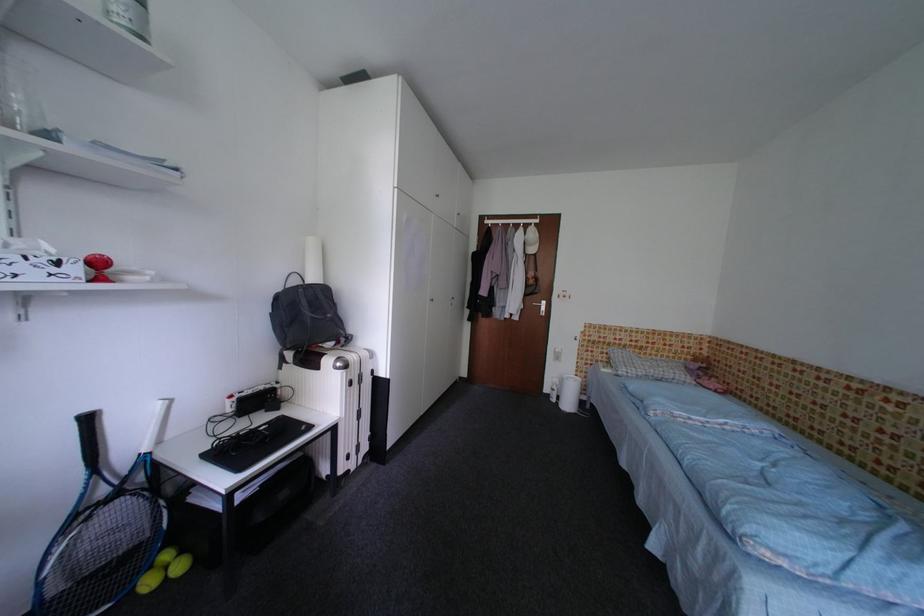
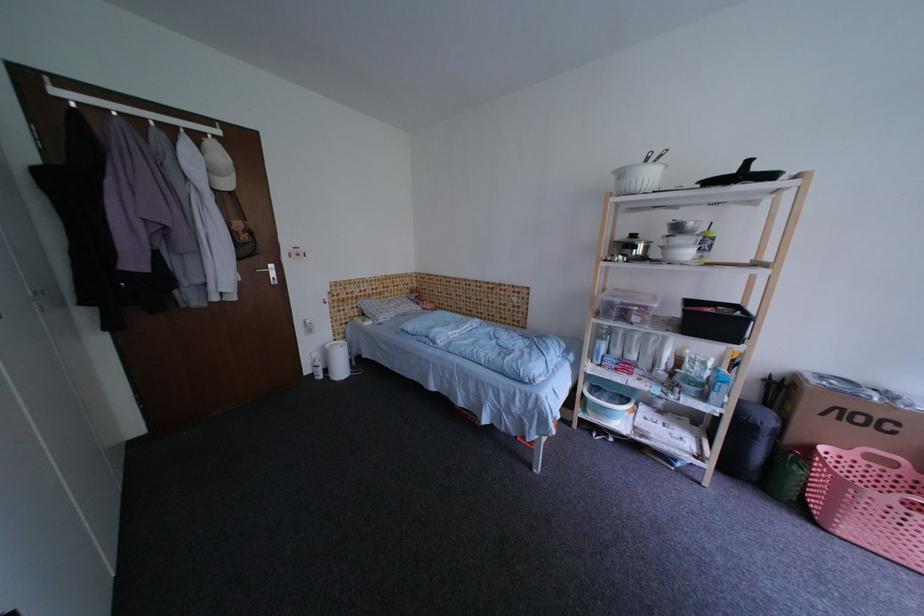
The point at [541,237] is marked in the first image. Where is the corresponding point in the second image?

(227, 158)